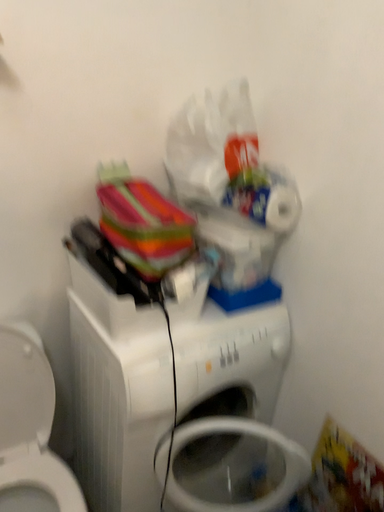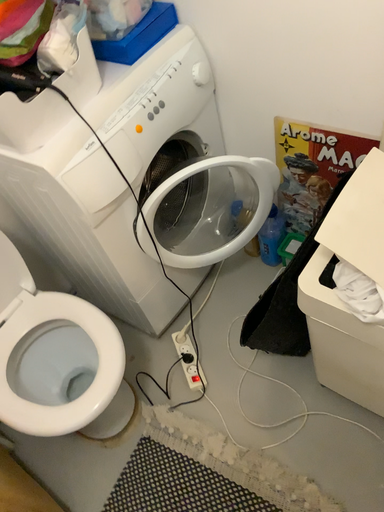
Question: How did the camera likely rotate when shooting the video?

Choices:
 (A) rotated right
 (B) rotated left

Answer: (A)